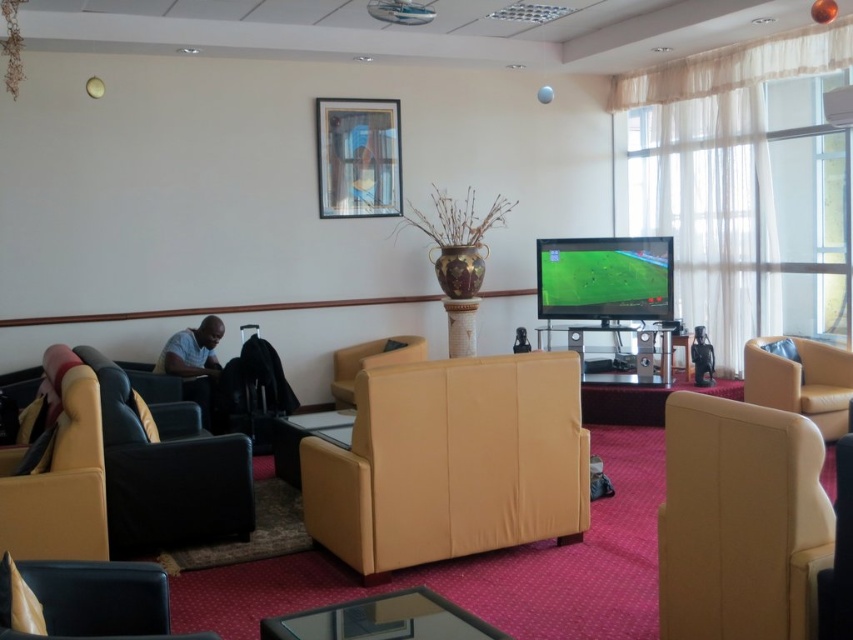
Question: Considering the real-world distances, which object is closest to the transparent glass table at lower center?

Choices:
 (A) transparent glass table at center
 (B) matte black chair at lower left

Answer: (B)

Question: Which point is farther to the camera?

Choices:
 (A) (827, 356)
 (B) (187, 531)

Answer: (A)

Question: Can you confirm if wooden frame at upper center is positioned to the left of matte yellow armchair at right?

Choices:
 (A) yes
 (B) no

Answer: (A)

Question: Can you confirm if transparent glass table at lower center is thinner than matte yellow armchair at right?

Choices:
 (A) no
 (B) yes

Answer: (A)

Question: Is leather at right to the right of matte yellow armchair at right from the viewer's perspective?

Choices:
 (A) no
 (B) yes

Answer: (A)

Question: Estimate the real-world distances between objects in this image. Which object is farther from the transparent glass table at lower center?

Choices:
 (A) matte black chair at lower left
 (B) matte yellow armchair at right
 (C) wooden frame at upper center
 (D) matte yellow leather couch at center

Answer: (C)